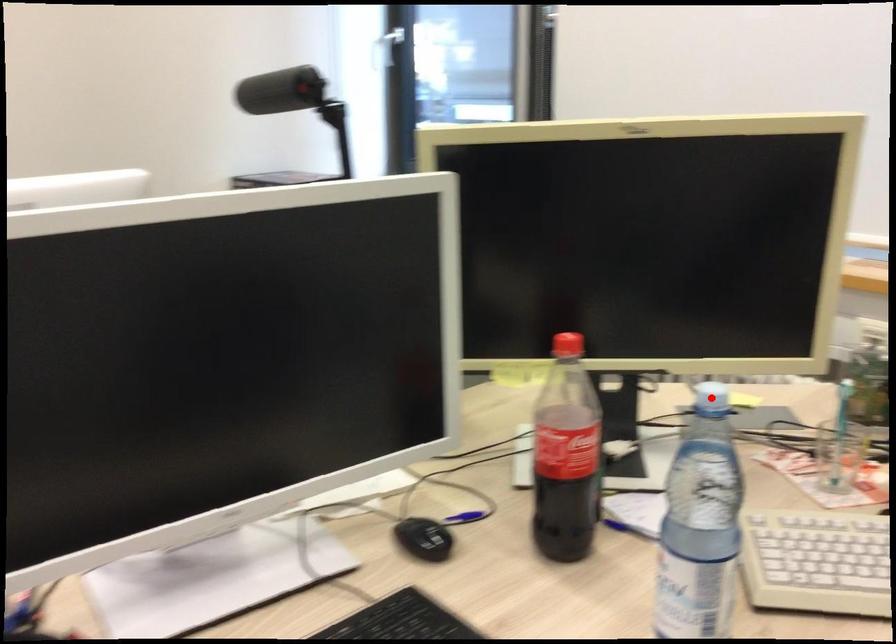
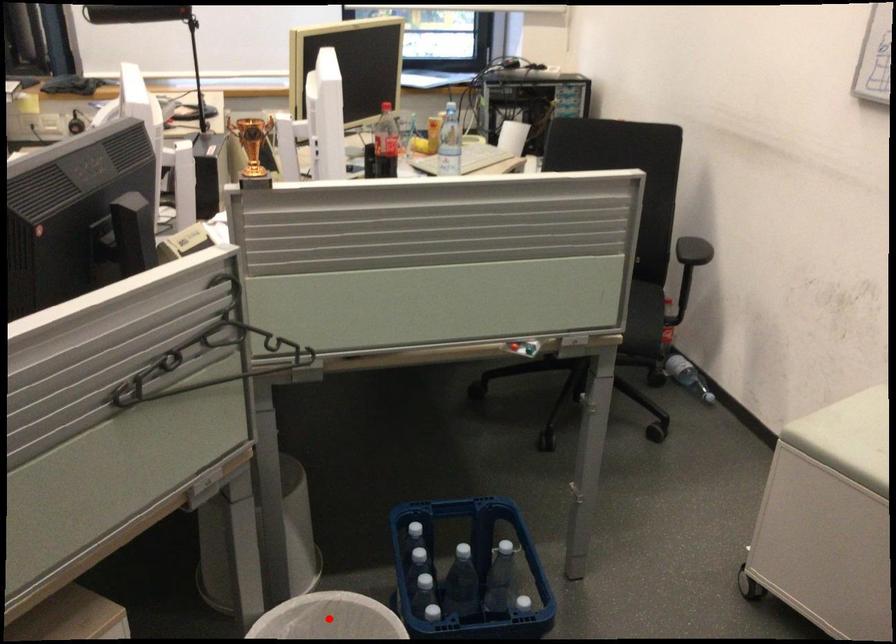
I am providing you with two images of the same scene from different viewpoints. A red point is marked on the first image and another point is marked on the second image. Is the red point in image1 aligned with the point shown in image2?

No